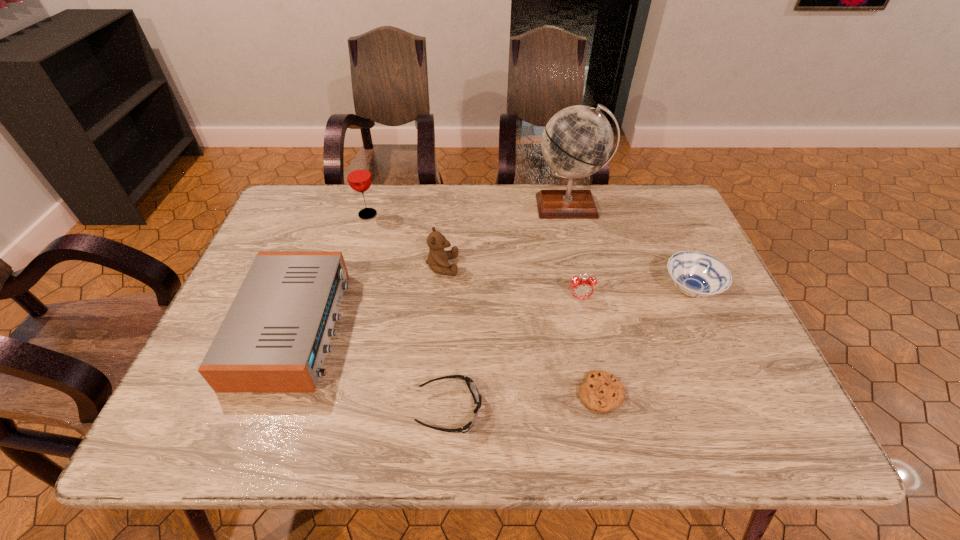
Find the location of `the tallest object`. the tallest object is located at coordinates (577, 141).

Where is `the second tallest object`? the second tallest object is located at coordinates (359, 177).

Locate an element on the screen. This screenshot has height=540, width=960. teddy bear is located at coordinates (437, 260).

This screenshot has width=960, height=540. Identify the location of alarm clock. (581, 288).

Identify the location of radio receiver. Image resolution: width=960 pixels, height=540 pixels. (274, 338).

Identify the location of the sixth tallest object. (696, 274).

Image resolution: width=960 pixels, height=540 pixels. I want to click on the rightmost object, so click(x=696, y=274).

The width and height of the screenshot is (960, 540). What are the coordinates of `the second shortest object` in the screenshot? It's located at (470, 383).

Identify the location of cookie. Image resolution: width=960 pixels, height=540 pixels. (601, 392).

Find the location of a particular element. free spot located at the equator of the tallest object is located at coordinates (580, 252).